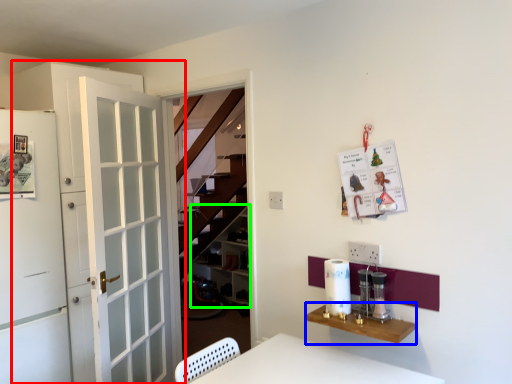
Question: Based on their relative distances, which object is nearer to door (highlighted by a red box)? Choose from table (highlighted by a blue box) and shelf (highlighted by a green box).

Choices:
 (A) table
 (B) shelf

Answer: (A)